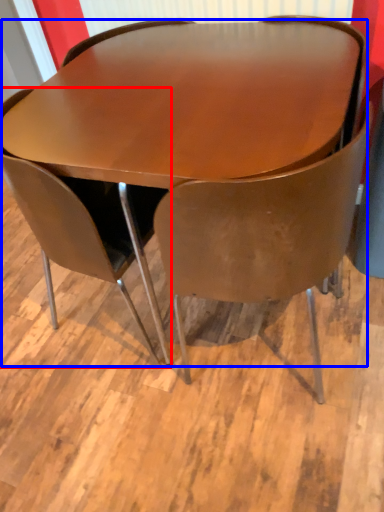
Question: Which object is further to the camera taking this photo, chair (highlighted by a red box) or table (highlighted by a blue box)?

Choices:
 (A) chair
 (B) table

Answer: (A)